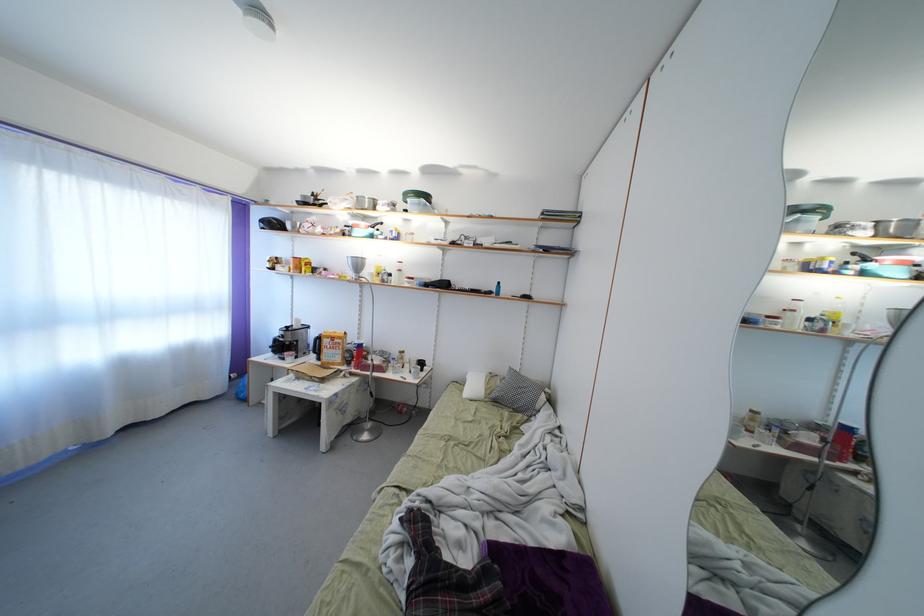
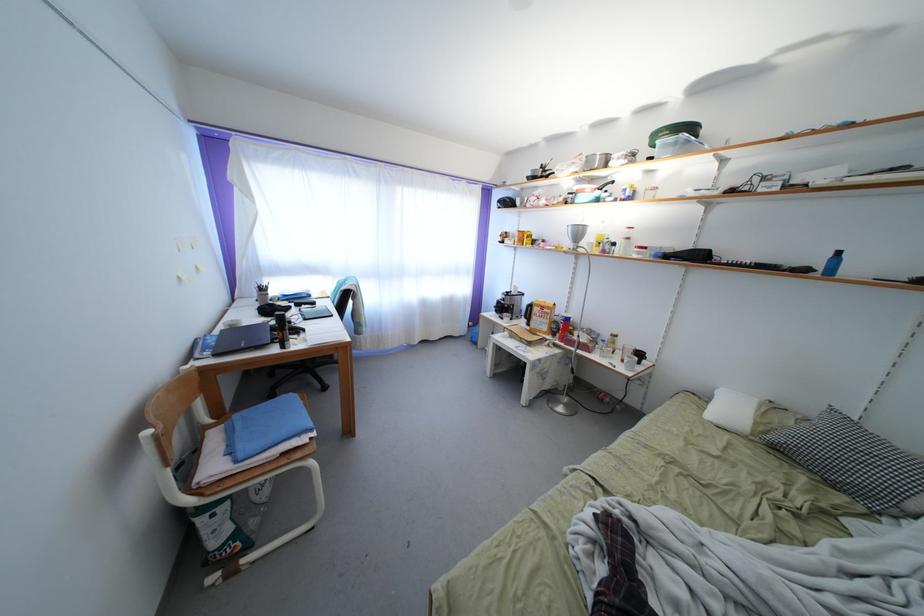
Locate, in the second image, the point that corresponds to point 338,341 in the first image.

(549, 310)